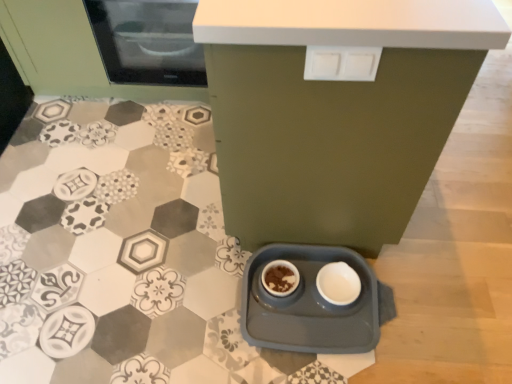
You are a GUI agent. You are given a task and a screenshot of the screen. Output one action in this format:
    pyautogui.click(x=<x>, y=<y>)
    Task: Click on the matte ceramic bowl at center
    
    Given the screenshot: What is the action you would take?
    pyautogui.click(x=280, y=278)

Where is `matte black microwave at upper left`? Image resolution: width=512 pixels, height=384 pixels. matte black microwave at upper left is located at coordinates (148, 41).

Is matte ceramic bowl at center facing towards white glossy bowl at lower center?

No.

From a real-world perspective, does matte ceramic bowl at center stand above white glossy bowl at lower center?

Indeed, from a real-world perspective, matte ceramic bowl at center stands above white glossy bowl at lower center.

Is matte ceramic bowl at center at the right side of white glossy bowl at lower center?

No.

Is matte ceramic bowl at center wider than white glossy bowl at lower center?

No, matte ceramic bowl at center is not wider than white glossy bowl at lower center.

Is gray plastic tray at lower center not close to matte green cabinet at lower center?

They are positioned close to each other.

Which of these two, gray plastic tray at lower center or matte green cabinet at lower center, is thinner?

With smaller width is gray plastic tray at lower center.

Does gray plastic tray at lower center appear on the right side of matte green cabinet at lower center?

In fact, gray plastic tray at lower center is to the left of matte green cabinet at lower center.

Considering the positions of objects gray plastic tray at lower center and matte green cabinet at lower center in the image provided, who is in front, gray plastic tray at lower center or matte green cabinet at lower center?

matte green cabinet at lower center is closer to the camera.

Can you confirm if matte green cabinet at lower center is smaller than gray plastic tray at lower center?

No.

Who is more distant, matte green cabinet at lower center or gray plastic tray at lower center?

gray plastic tray at lower center is more distant.

Could you tell me if matte green cabinet at lower center is facing gray plastic tray at lower center?

No, matte green cabinet at lower center is not aimed at gray plastic tray at lower center.

Where is `table located in front of the gray plastic tray at lower center`? This screenshot has width=512, height=384. table located in front of the gray plastic tray at lower center is located at coordinates tap(335, 112).

From a real-world perspective, is matte ceramic bowl at center beneath white plastic drawer at upper center?

Correct, in the physical world, matte ceramic bowl at center is lower than white plastic drawer at upper center.

Considering their positions, is matte ceramic bowl at center located in front of or behind white plastic drawer at upper center?

In the image, matte ceramic bowl at center appears behind white plastic drawer at upper center.

Based on the photo, which object is wider, matte ceramic bowl at center or white plastic drawer at upper center?

matte ceramic bowl at center.

You are a GUI agent. You are given a task and a screenshot of the screen. Output one action in this format:
    pyautogui.click(x=<x>, y=<y>)
    Task: Click on the home appliance above the gray plastic tray at lower center (from a real-world perspective)
    The height and width of the screenshot is (384, 512).
    Given the screenshot: What is the action you would take?
    (x=148, y=41)

Is matte black microwave at upper left oriented away from gray plastic tray at lower center?

No, matte black microwave at upper left's orientation is not away from gray plastic tray at lower center.

Does matte black microwave at upper left appear on the left side of gray plastic tray at lower center?

Correct, you'll find matte black microwave at upper left to the left of gray plastic tray at lower center.

From a real-world perspective, is gray plastic tray at lower center on top of matte black microwave at upper left?

No, from a real-world perspective, gray plastic tray at lower center is not on top of matte black microwave at upper left.

Who is bigger, gray plastic tray at lower center or matte black microwave at upper left?

matte black microwave at upper left is bigger.

In the scene shown: From the image's perspective, which object appears higher, gray plastic tray at lower center or matte black microwave at upper left?

matte black microwave at upper left.

How far apart are gray plastic tray at lower center and matte ceramic bowl at center?

A distance of 12.26 centimeters exists between gray plastic tray at lower center and matte ceramic bowl at center.

Which object is wider, gray plastic tray at lower center or matte ceramic bowl at center?

gray plastic tray at lower center is wider.

Between gray plastic tray at lower center and matte ceramic bowl at center, which one appears on the left side from the viewer's perspective?

matte ceramic bowl at center is more to the left.

Identify the location of appliance that is under the matte ceramic bowl at center (from a real-world perspective). The height and width of the screenshot is (384, 512). (309, 304).

Identify the location of coffee cup above the white glossy bowl at lower center (from the image's perspective). (280, 278).

Image resolution: width=512 pixels, height=384 pixels. I want to click on appliance behind the matte green cabinet at lower center, so click(309, 304).

Considering their positions, is white glossy bowl at lower center positioned further to white plastic drawer at upper center than matte green cabinet at lower center?

white glossy bowl at lower center is positioned further to the anchor white plastic drawer at upper center.

Which object lies nearer to the anchor point matte black microwave at upper left, matte ceramic bowl at center or white plastic drawer at upper center?

Among the two, matte ceramic bowl at center is located nearer to matte black microwave at upper left.

Considering their positions, is white plastic drawer at upper center positioned further to matte ceramic bowl at center than matte green cabinet at lower center?

The object further to matte ceramic bowl at center is white plastic drawer at upper center.

Based on their spatial positions, is white glossy bowl at lower center or matte green cabinet at lower center further from gray plastic tray at lower center?

Based on the image, matte green cabinet at lower center appears to be further to gray plastic tray at lower center.

From the image, which object appears to be farther from white glossy bowl at lower center, matte green cabinet at lower center or gray plastic tray at lower center?

matte green cabinet at lower center lies further to white glossy bowl at lower center than the other object.

When comparing their distances from gray plastic tray at lower center, does matte green cabinet at lower center or matte black microwave at upper left seem further?

The object further to gray plastic tray at lower center is matte black microwave at upper left.

Estimate the real-world distances between objects in this image. Which object is further from white glossy bowl at lower center, matte black microwave at upper left or white plastic drawer at upper center?

Based on the image, matte black microwave at upper left appears to be further to white glossy bowl at lower center.

When comparing their distances from matte black microwave at upper left, does matte ceramic bowl at center or gray plastic tray at lower center seem closer?

gray plastic tray at lower center is closer to matte black microwave at upper left.

Image resolution: width=512 pixels, height=384 pixels. In order to click on drawer that lies between matte green cabinet at lower center and gray plastic tray at lower center from top to bottom in this screenshot , I will do `click(341, 63)`.

Find the location of a particular element. drawer between matte black microwave at upper left and gray plastic tray at lower center vertically is located at coordinates (341, 63).

You are a GUI agent. You are given a task and a screenshot of the screen. Output one action in this format:
    pyautogui.click(x=<x>, y=<y>)
    Task: Click on the coffee cup between white plastic drawer at upper center and white glossy bowl at lower center vertically
    This screenshot has height=384, width=512.
    Given the screenshot: What is the action you would take?
    pyautogui.click(x=280, y=278)

Locate an element on the screen. Image resolution: width=512 pixels, height=384 pixels. bowl between matte black microwave at upper left and gray plastic tray at lower center from top to bottom is located at coordinates (338, 283).